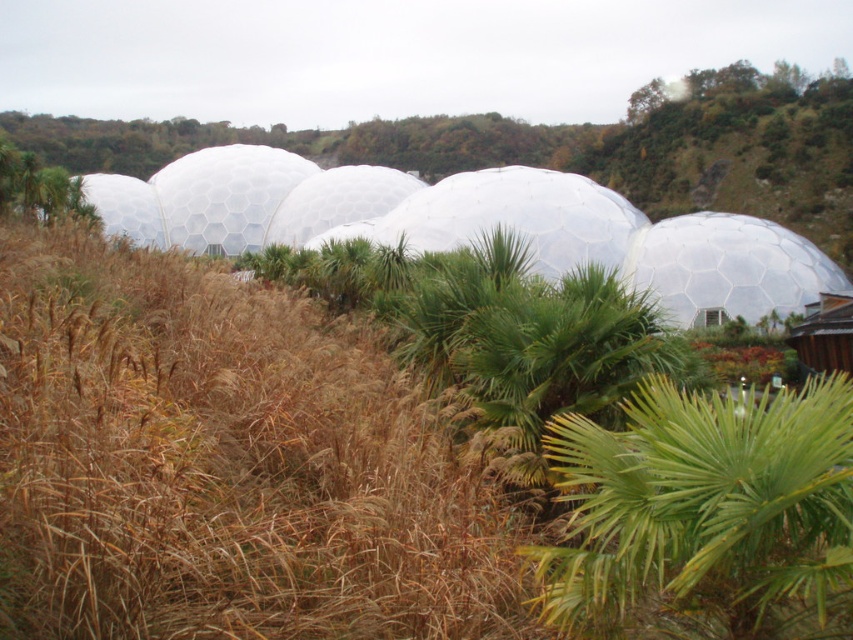
Question: Which point is closer to the camera taking this photo?

Choices:
 (A) (665, 289)
 (B) (704, 396)

Answer: (B)

Question: Which object appears farthest from the camera in this image?

Choices:
 (A) green leafy palm at center
 (B) transparent plastic dome at right

Answer: (B)

Question: Which point appears farthest from the camera in this image?

Choices:
 (A) (544, 600)
 (B) (833, 280)

Answer: (B)

Question: Can you confirm if green leafy palm at center is positioned above transparent plastic dome at right?

Choices:
 (A) no
 (B) yes

Answer: (A)

Question: Does green leafy palm at center appear on the left side of transparent plastic dome at right?

Choices:
 (A) yes
 (B) no

Answer: (A)

Question: Is green leafy palm at center to the right of transparent plastic dome at right from the viewer's perspective?

Choices:
 (A) no
 (B) yes

Answer: (A)